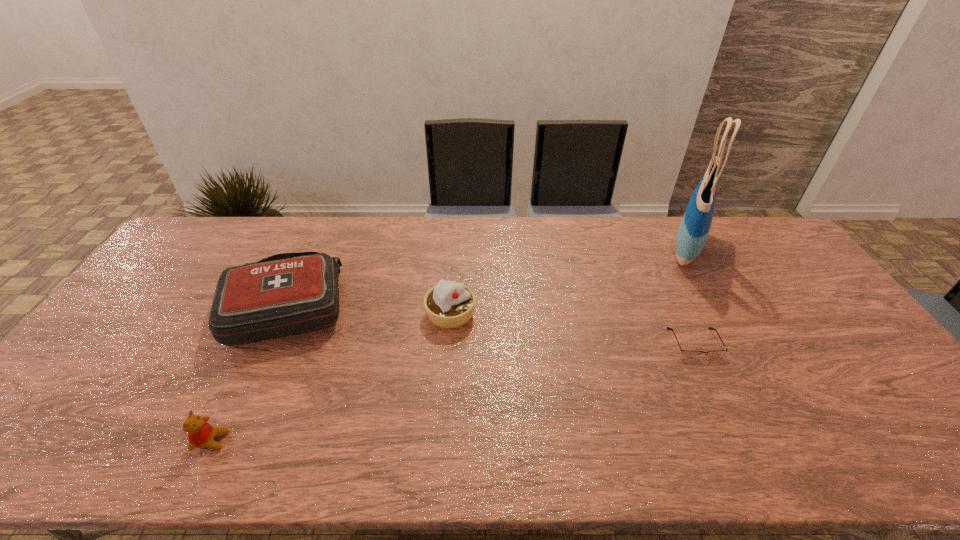
Find the location of a particular element. Image resolution: width=960 pixels, height=540 pixels. free spot between the spectacles and the nearest object is located at coordinates (453, 392).

Locate an element on the screen. The image size is (960, 540). free space between the shortest object and the tote bag is located at coordinates (690, 295).

The height and width of the screenshot is (540, 960). Identify the location of free spot between the tallest object and the first-aid kit. coord(487,276).

You are a GUI agent. You are given a task and a screenshot of the screen. Output one action in this format:
    pyautogui.click(x=<x>, y=<y>)
    Task: Click on the empty space that is in between the whipped cream and the first-aid kit
    
    Given the screenshot: What is the action you would take?
    pyautogui.click(x=369, y=309)

The width and height of the screenshot is (960, 540). What are the coordinates of `vacant area that lies between the tote bag and the whipped cream` in the screenshot? It's located at (568, 280).

Identify which object is the fourth closest to the nearest object. Please provide its 2D coordinates. Your answer should be formatted as a tuple, i.e. [(x, y)], where the tuple contains the x and y coordinates of a point satisfying the conditions above.

[(694, 228)]

Locate an element on the screen. object identified as the closest to the first-aid kit is located at coordinates (201, 434).

Find the location of a particular element. blank area in the image that satisfies the following two spatial constraints: 1. on the front-facing side of the shortest object; 2. on the front-facing side of the nearest object is located at coordinates (739, 441).

This screenshot has height=540, width=960. Identify the location of vacant area in the image that satisfies the following two spatial constraints: 1. on the front side of the first-aid kit; 2. on the right side of the whipped cream. (283, 314).